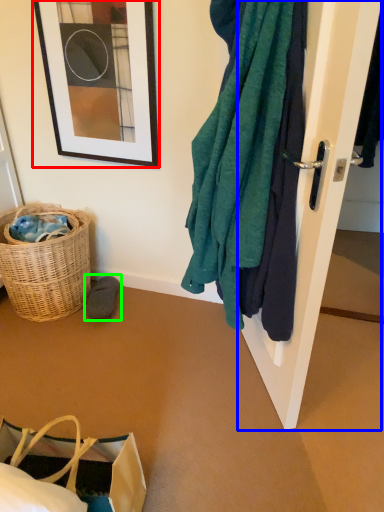
Question: Which is farther away from picture frame (highlighted by a red box)? door (highlighted by a blue box) or footwear (highlighted by a green box)?

Choices:
 (A) door
 (B) footwear

Answer: (A)